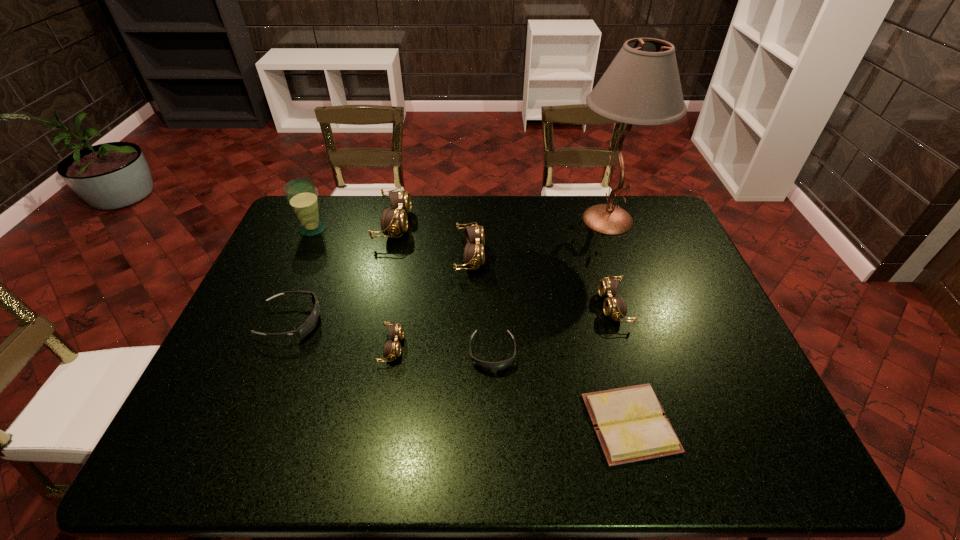
At what (x,y) coordinates should I click in order to perform the action: click on the leftmost goggles. Please return your answer as a coordinate pair (x, y). Looking at the image, I should click on (310, 323).

At what (x,y) coordinates should I click in order to perform the action: click on the smallest brown goggles. Please return your answer as a coordinate pair (x, y). Image resolution: width=960 pixels, height=540 pixels. Looking at the image, I should click on (392, 350).

Where is `the smaller black goggles`? the smaller black goggles is located at coordinates (484, 365).

Image resolution: width=960 pixels, height=540 pixels. Find the location of `the second shortest object`. the second shortest object is located at coordinates (484, 365).

In order to click on the shortest object in this screenshot , I will do [x=630, y=423].

You are a GUI agent. You are given a task and a screenshot of the screen. Output one action in this format:
    pyautogui.click(x=<x>, y=<y>)
    Task: Click on the nearest object
    This screenshot has height=540, width=960.
    Given the screenshot: What is the action you would take?
    pyautogui.click(x=630, y=423)

You are a GUI agent. You are given a task and a screenshot of the screen. Output one action in this format:
    pyautogui.click(x=<x>, y=<y>)
    Task: Click on the vacant space located on the front-facing side of the table lamp
    
    Given the screenshot: What is the action you would take?
    pyautogui.click(x=460, y=220)

Identify the location of free region located on the front-facing side of the table lamp. This screenshot has height=540, width=960. (525, 220).

Identify the location of free location located 0.260m on the front-facing side of the table lamp. This screenshot has height=540, width=960. (493, 220).

Where is `vacant region located on the right of the blue glass`? Image resolution: width=960 pixels, height=540 pixels. vacant region located on the right of the blue glass is located at coordinates (359, 229).